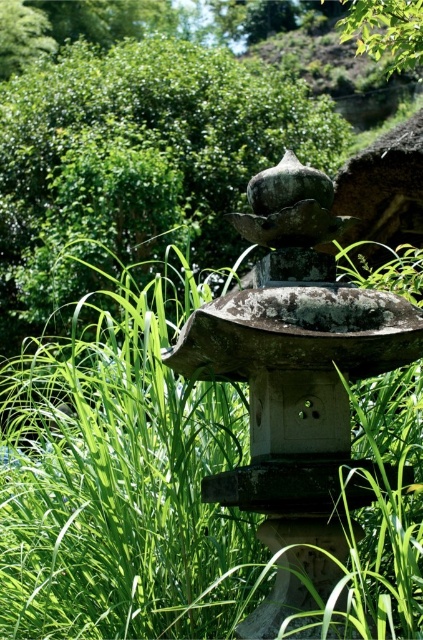
Does green grass at center have a larger size compared to green leafy bush at upper center?

Actually, green grass at center might be smaller than green leafy bush at upper center.

Is point (216, 397) closer to viewer compared to point (123, 92)?

That is True.

The width and height of the screenshot is (423, 640). What do you see at coordinates (120, 481) in the screenshot?
I see `green grass at center` at bounding box center [120, 481].

Where is `green grass at center`? Image resolution: width=423 pixels, height=640 pixels. green grass at center is located at coordinates (120, 481).